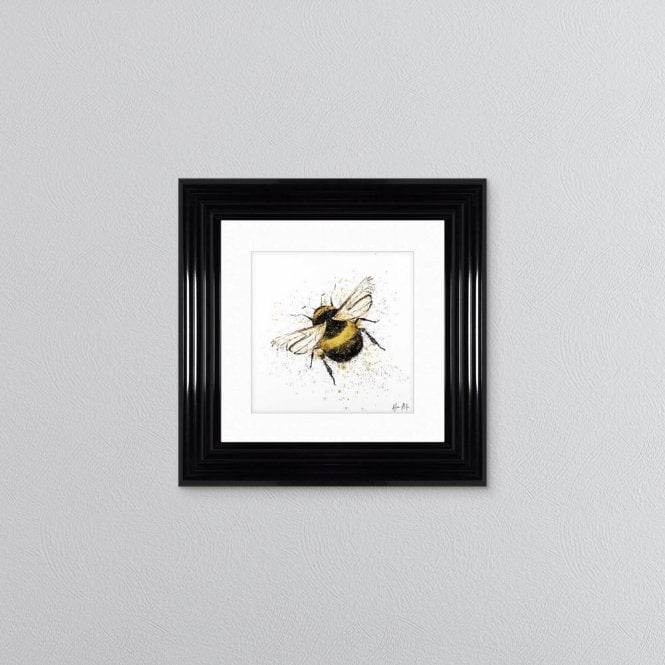
Where is `white picture mat`? white picture mat is located at coordinates (231, 426).